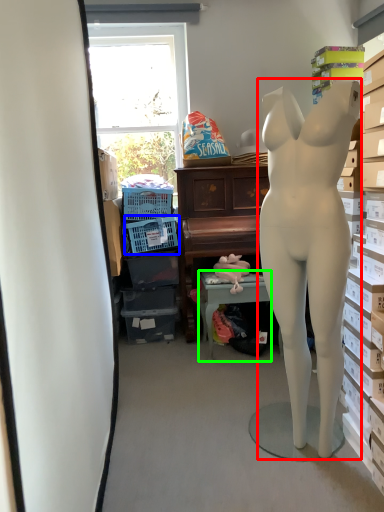
Question: Which is farther away from person (highlighted by a red box)? laundry basket (highlighted by a blue box) or table (highlighted by a green box)?

Choices:
 (A) laundry basket
 (B) table

Answer: (A)